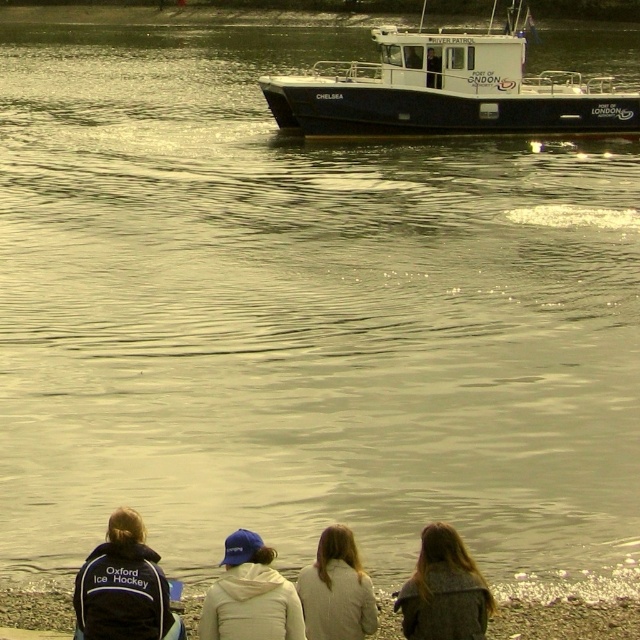
You are standing at the point marked by the coordinates point (564, 618). Based on the scene description, what type of terrain would you expect to find under your feet?

The point (564, 618) corresponds to the smooth sand shoreline at lower center, so you would expect to find smooth sand under your feet.

You are standing at the riverside and want to retrieve the white fleece jacket at lower center. However, there is a white plastic boat at upper center in your way. Can you reach the jacket without moving the boat?

The white plastic boat at upper center is located above the white fleece jacket at lower center, so you can reach the jacket without moving the boat since it is positioned below the boat.